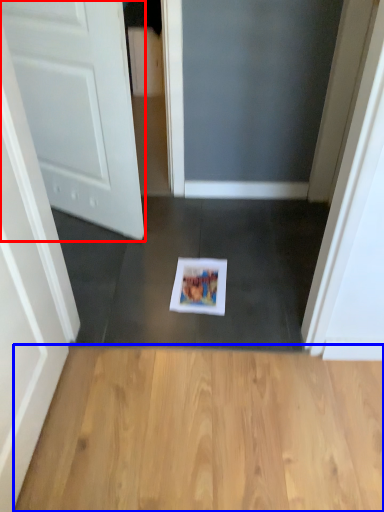
Question: Which point is closer to the camera, door (highlighted by a red box) or hardwood (highlighted by a blue box)?

Choices:
 (A) door
 (B) hardwood

Answer: (B)